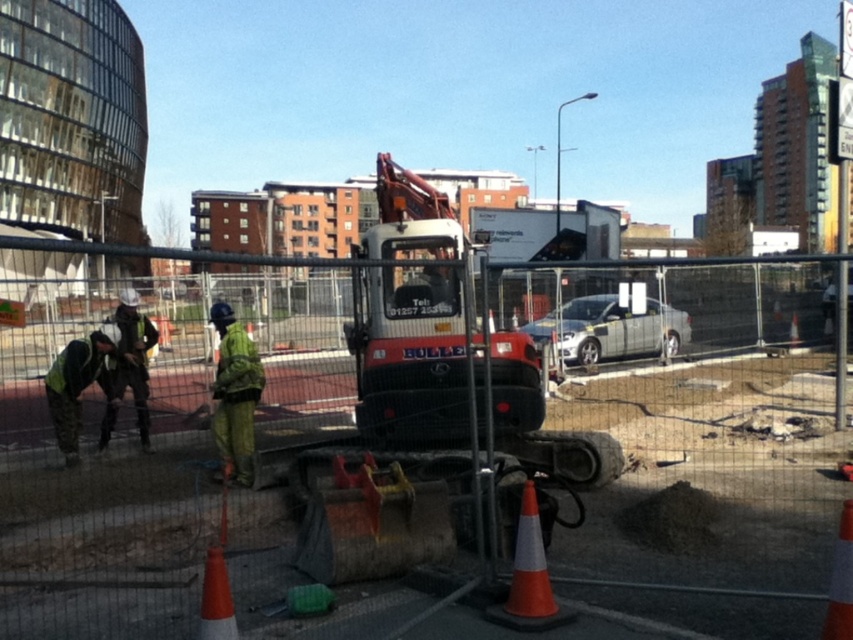
Question: Which point is closer to the camera?

Choices:
 (A) click(141, 408)
 (B) click(563, 612)

Answer: (B)

Question: Is reflective yellow safety vest at lower left above green reflective safety vest at left?

Choices:
 (A) no
 (B) yes

Answer: (A)

Question: Among these points, which one is nearest to the camera?

Choices:
 (A) (227, 628)
 (B) (839, 540)

Answer: (A)

Question: Does orange/white striped traffic cone at lower center have a lesser width compared to green reflective safety vest at left?

Choices:
 (A) yes
 (B) no

Answer: (A)

Question: Which object is farther from the camera taking this photo?

Choices:
 (A) orange/reflective traffic cone at center
 (B) orange plastic traffic cone at lower left

Answer: (A)

Question: Is matte black excavator at center positioned before orange plastic traffic cone at lower left?

Choices:
 (A) yes
 (B) no

Answer: (A)